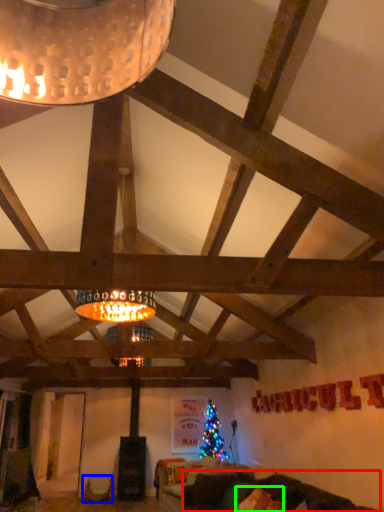
Question: Considering the real-world distances, which object is farthest from couch (highlighted by a red box)? furniture (highlighted by a blue box) or pillow (highlighted by a green box)?

Choices:
 (A) furniture
 (B) pillow

Answer: (A)